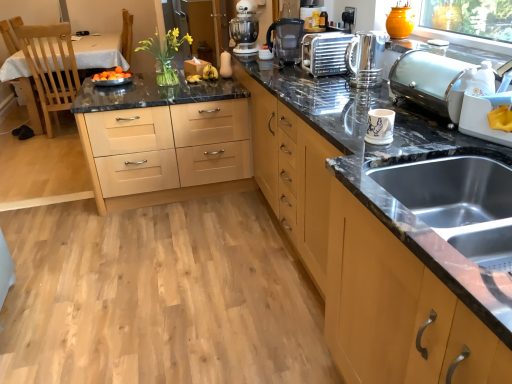
The width and height of the screenshot is (512, 384). I want to click on free spot behind white ceramic mug at upper right, which is the second appliance in left-to-right order, so click(x=366, y=125).